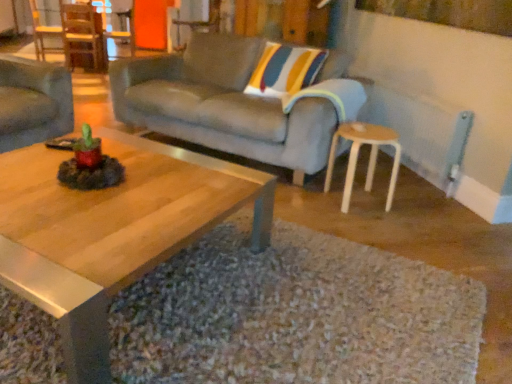
Question: From the image's perspective, does matte gray couch at left, which is the 1th studio couch in left-to-right order, appear lower than wooden polished coffee table at center?

Choices:
 (A) yes
 (B) no

Answer: (B)

Question: Is matte gray couch at left, positioned as the second studio couch in right-to-left order, wider than wooden polished coffee table at center?

Choices:
 (A) yes
 (B) no

Answer: (B)

Question: From a real-world perspective, is matte gray couch at left, positioned as the second studio couch in right-to-left order, below wooden polished coffee table at center?

Choices:
 (A) yes
 (B) no

Answer: (B)

Question: Is matte gray couch at left, positioned as the second studio couch in right-to-left order, to the right of wooden polished coffee table at center from the viewer's perspective?

Choices:
 (A) no
 (B) yes

Answer: (A)

Question: Is matte gray couch at left, positioned as the second studio couch in right-to-left order, far from wooden polished coffee table at center?

Choices:
 (A) yes
 (B) no

Answer: (A)

Question: Is the depth of matte gray couch at left, positioned as the second studio couch in right-to-left order, less than that of wooden polished coffee table at center?

Choices:
 (A) no
 (B) yes

Answer: (A)

Question: Does matte gray couch at left, which is the 1th studio couch in left-to-right order, have a larger size compared to wooden chair at center, which is the 2th chair in left-to-right order?

Choices:
 (A) no
 (B) yes

Answer: (B)

Question: Considering the relative positions of matte gray couch at left, which is the 1th studio couch in left-to-right order, and wooden chair at center, which is the first chair from front to back, in the image provided, is matte gray couch at left, which is the 1th studio couch in left-to-right order, to the right of wooden chair at center, which is the first chair from front to back, from the viewer's perspective?

Choices:
 (A) no
 (B) yes

Answer: (A)

Question: From the image's perspective, is matte gray couch at left, positioned as the second studio couch in right-to-left order, located beneath wooden chair at center, which is the first chair from front to back?

Choices:
 (A) no
 (B) yes

Answer: (B)

Question: Is wooden chair at center, which is the 2th chair in left-to-right order, surrounded by matte gray couch at left, positioned as the second studio couch in right-to-left order?

Choices:
 (A) yes
 (B) no

Answer: (B)

Question: Is matte gray couch at left, which is the 1th studio couch in left-to-right order, aimed at wooden chair at center, the second chair viewed from the back?

Choices:
 (A) yes
 (B) no

Answer: (B)

Question: Is matte gray couch at left, which is the 1th studio couch in left-to-right order, not close to wooden chair at center, which is the first chair in right-to-left order?

Choices:
 (A) no
 (B) yes

Answer: (B)

Question: Considering the relative sizes of wooden chair at left, the second chair viewed from the front, and matte gray couch at left, positioned as the second studio couch in right-to-left order, in the image provided, is wooden chair at left, the second chair viewed from the front, wider than matte gray couch at left, positioned as the second studio couch in right-to-left order,?

Choices:
 (A) yes
 (B) no

Answer: (B)